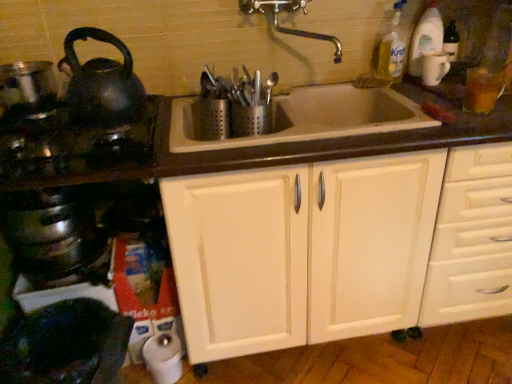
Identify the location of free space to the left of yellow plastic bottle at upper right, which appears as the second bottle when viewed from the right. (351, 79).